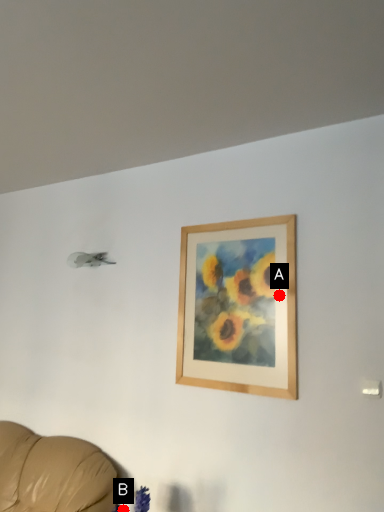
Question: Two points are circled on the image, labeled by A and B beside each circle. Which of the following is the closest to the observer?

Choices:
 (A) A is closer
 (B) B is closer

Answer: (B)